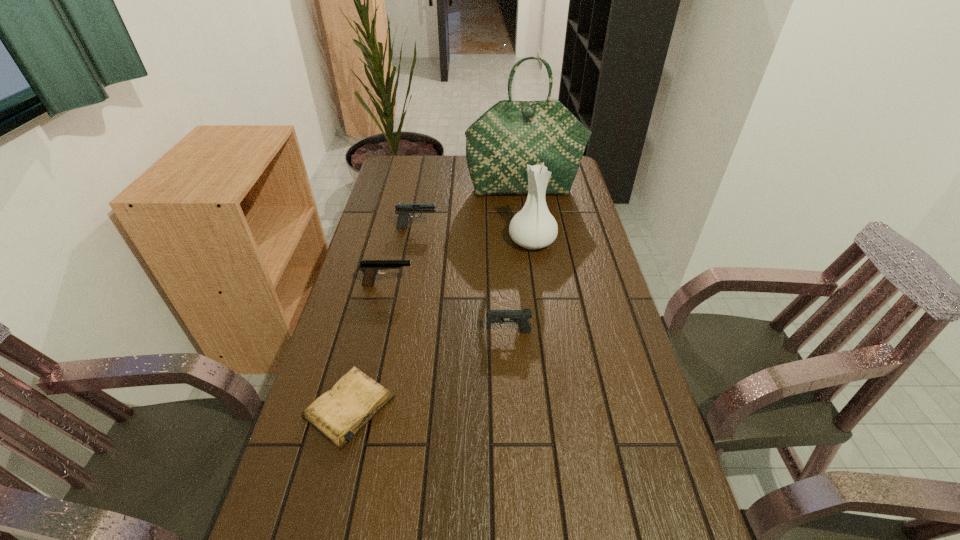
I want to click on free space between the second tallest object and the nearest pistol, so click(x=520, y=287).

What are the coordinates of `unoccupied position between the shortest object and the farthest pistol` in the screenshot? It's located at (383, 317).

Where is `free space between the nearest pistol and the diary`? free space between the nearest pistol and the diary is located at coordinates (429, 369).

Where is `vacant area that lies between the shortest object and the rightmost pistol`? This screenshot has height=540, width=960. vacant area that lies between the shortest object and the rightmost pistol is located at coordinates (429, 369).

Locate which object is the third closest to the second tallest object. Please provide its 2D coordinates. Your answer should be formatted as a tuple, i.e. [(x, y)], where the tuple contains the x and y coordinates of a point satisfying the conditions above.

[(520, 317)]

Locate an element on the screen. This screenshot has height=540, width=960. the fourth closest object to the rightmost pistol is located at coordinates (402, 209).

Select which pistol is the closest to the third nearest object. Please provide its 2D coordinates. Your answer should be formatted as a tuple, i.e. [(x, y)], where the tuple contains the x and y coordinates of a point satisfying the conditions above.

[(520, 317)]

Locate an element on the screen. pistol that stands as the closest to the vase is located at coordinates (402, 209).

Where is `vacant space that satisfies the following two spatial constraints: 1. on the front side of the farthest object; 2. on the right side of the vase`? vacant space that satisfies the following two spatial constraints: 1. on the front side of the farthest object; 2. on the right side of the vase is located at coordinates (531, 242).

I want to click on free space that satisfies the following two spatial constraints: 1. on the front side of the second tallest object; 2. at the barrel of the fifth farthest object, so click(545, 332).